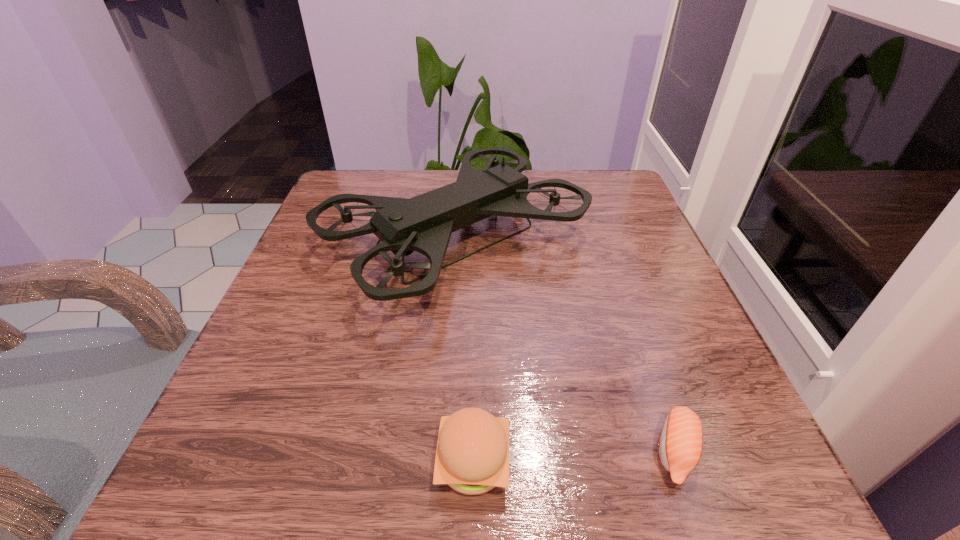
Identify the location of object that is positioned at the left edge. The height and width of the screenshot is (540, 960). (424, 223).

Find the location of a particular element. drone situated at the right edge is located at coordinates (424, 223).

Locate an element on the screen. Image resolution: width=960 pixels, height=540 pixels. sushi located at the right edge is located at coordinates (680, 446).

At what (x,y) coordinates should I click in order to perform the action: click on object that is at the far left corner. Please return your answer as a coordinate pair (x, y). Looking at the image, I should click on (424, 223).

Where is `object located at the far right corner`? object located at the far right corner is located at coordinates (424, 223).

Identify the location of object located in the near right corner section of the desktop. (680, 446).

Image resolution: width=960 pixels, height=540 pixels. Find the location of `vacant area at the near edge`. vacant area at the near edge is located at coordinates (344, 496).

The image size is (960, 540). What are the coordinates of `vacant space at the left edge` in the screenshot? It's located at (310, 292).

What are the coordinates of `vacant space at the right edge of the desktop` in the screenshot? It's located at (640, 240).

In order to click on vacant space at the far left corner of the desktop in this screenshot , I will do `click(352, 170)`.